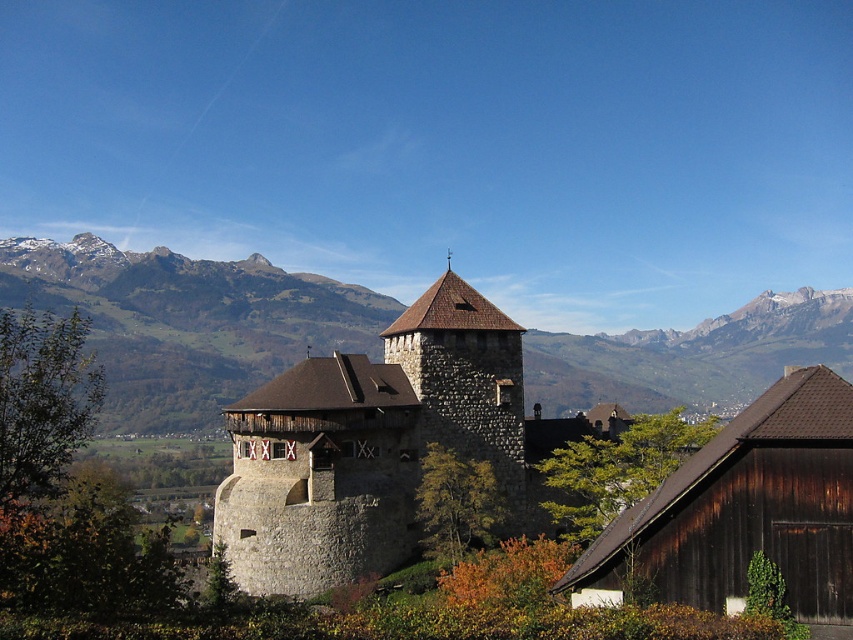
Is stone tower at center further to the viewer compared to brown stone tower at center?

No, it is not.

Looking at this image, measure the distance between stone tower at center and camera.

A distance of 188.46 feet exists between stone tower at center and camera.

Locate an element on the screen. stone tower at center is located at coordinates (376, 445).

The height and width of the screenshot is (640, 853). Describe the element at coordinates (187, 321) in the screenshot. I see `brown rocky mountain range at upper center` at that location.

Who is more forward, (646, 396) or (419, 400)?

Point (419, 400) is in front.

Is point (132, 420) less distant than point (434, 321)?

No, it is behind (434, 321).

Identify the location of brown rocky mountain range at upper center. (187, 321).

Does brown rocky mountain range at upper center appear over stone tower at center?

Yes, brown rocky mountain range at upper center is above stone tower at center.

Does point (12, 289) lie in front of point (525, 480)?

That is False.

Between point (820, 360) and point (276, 532), which one is positioned behind?

Positioned behind is point (820, 360).

Where is `brown rocky mountain range at upper center`? Image resolution: width=853 pixels, height=640 pixels. brown rocky mountain range at upper center is located at coordinates (187, 321).